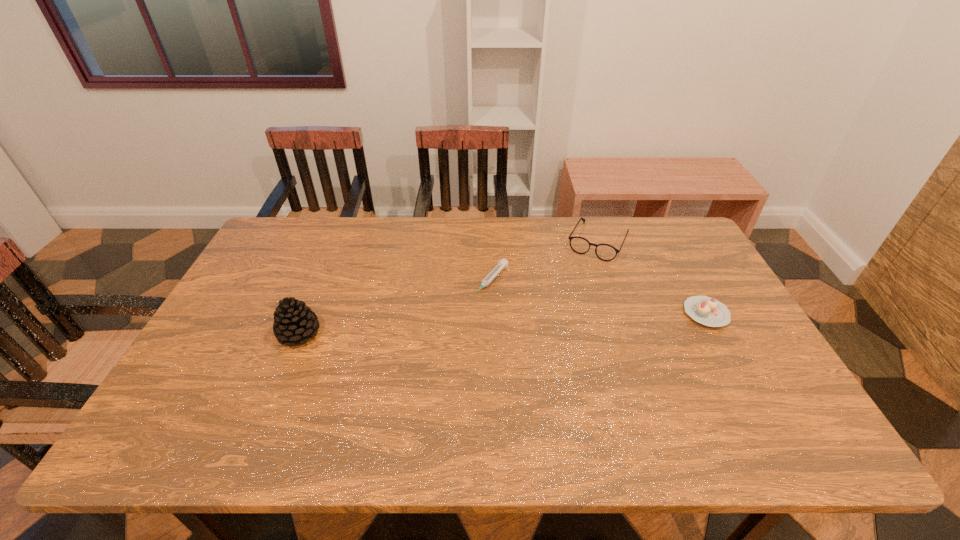
Find the location of a particular element. The height and width of the screenshot is (540, 960). free space on the desktop that is between the pinecone and the second shortest object and is positioned at the needle end of the syringe is located at coordinates (449, 326).

Locate an element on the screen. The height and width of the screenshot is (540, 960). vacant space on the desktop that is between the tallest object and the rightmost object and is positioned on the front-facing side of the spectacles is located at coordinates (558, 321).